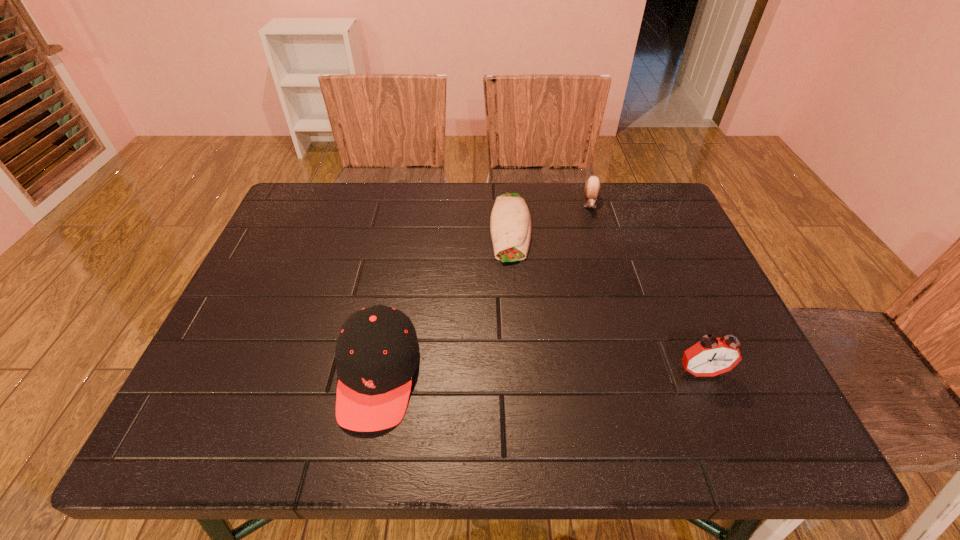
The image size is (960, 540). Identify the location of the leftmost object. (377, 351).

Locate an element on the screen. The height and width of the screenshot is (540, 960). alarm clock is located at coordinates (711, 356).

Where is `the second shortest object`? The height and width of the screenshot is (540, 960). the second shortest object is located at coordinates (592, 187).

You are a GUI agent. You are given a task and a screenshot of the screen. Output one action in this format:
    pyautogui.click(x=<x>, y=<y>)
    Task: Click on the escargot
    This screenshot has width=960, height=540.
    Given the screenshot: What is the action you would take?
    pyautogui.click(x=592, y=187)

Where is `burrito`? Image resolution: width=960 pixels, height=540 pixels. burrito is located at coordinates (510, 223).

I want to click on the shortest object, so click(510, 223).

You are a GUI agent. You are given a task and a screenshot of the screen. Output one action in this format:
    pyautogui.click(x=<x>, y=<y>)
    Task: Click on the blank area located 0.260m on the front-facing side of the second object from right to left
    The image size is (960, 540).
    Given the screenshot: What is the action you would take?
    pyautogui.click(x=591, y=278)

You are a GUI agent. You are given a task and a screenshot of the screen. Output one action in this format:
    pyautogui.click(x=<x>, y=<y>)
    Task: Click on the vacant space located on the front-facing side of the second object from right to left
    This screenshot has height=540, width=960.
    Given the screenshot: What is the action you would take?
    pyautogui.click(x=591, y=305)

Find the location of a particular element. free region located 0.340m on the front-facing side of the second object from right to left is located at coordinates (591, 302).

At what (x,y) coordinates should I click in order to perform the action: click on free space located 0.220m at the bitten end of the burrito. Please return your answer as a coordinate pair (x, y). The height and width of the screenshot is (540, 960). Looking at the image, I should click on (514, 333).